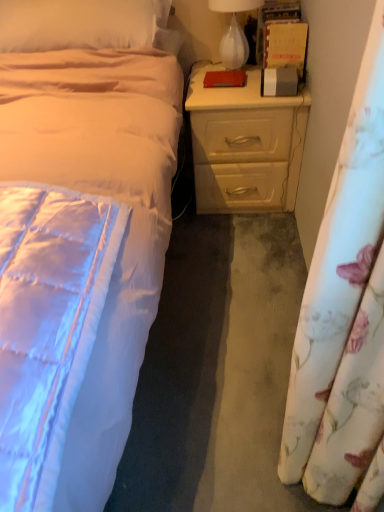
What do you see at coordinates (245, 145) in the screenshot?
I see `beige wood nightstand at right` at bounding box center [245, 145].

What is the approximate height of beige wood nightstand at right?

beige wood nightstand at right is 20.78 inches tall.

Image resolution: width=384 pixels, height=512 pixels. Describe the element at coordinates (80, 23) in the screenshot. I see `beige satin pillow at upper left` at that location.

I want to click on beige wood nightstand at right, so click(x=245, y=145).

Does point (279, 169) come farther from viewer compared to point (324, 321)?

That is True.

Is floral fabric curtain at right inside beige wood nightstand at right?

No, floral fabric curtain at right is not surrounded by beige wood nightstand at right.

How many degrees apart are the facing directions of beige wood nightstand at right and floral fabric curtain at right?

beige wood nightstand at right and floral fabric curtain at right are facing 90 degrees away from each other.

From a real-world perspective, which is physically above, beige wood nightstand at right or floral fabric curtain at right?

floral fabric curtain at right is physically above.

Which point is more forward, (203, 155) or (73, 1)?

The point (73, 1) is closer to the camera.

Is beige wood nightstand at right not close to beige satin pillow at upper left?

No, beige wood nightstand at right is not far from beige satin pillow at upper left.

Is beige wood nightstand at right not inside beige satin pillow at upper left?

That's correct, beige wood nightstand at right is outside of beige satin pillow at upper left.

Is beige wood nightstand at right shorter than beige satin pillow at upper left?

No.

Between beige satin pillow at upper left and white glass lamp at upper right, which one has more height?

beige satin pillow at upper left is taller.

From a real-world perspective, is beige satin pillow at upper left physically above white glass lamp at upper right?

Yes, from a real-world perspective, beige satin pillow at upper left is on top of white glass lamp at upper right.

Is beige satin pillow at upper left beside white glass lamp at upper right?

beige satin pillow at upper left and white glass lamp at upper right are clearly separated.

Identify the location of lamp below the beige satin pillow at upper left (from a real-world perspective). The width and height of the screenshot is (384, 512). (234, 31).

Is floral fabric curtain at right turned away from white glass lamp at upper right?

No.

Between floral fabric curtain at right and white glass lamp at upper right, which one has larger size?

Bigger between the two is floral fabric curtain at right.

Does floral fabric curtain at right appear on the left side of white glass lamp at upper right?

No.

Which object is further away from the camera taking this photo, beige wood nightstand at right or white glass lamp at upper right?

Positioned behind is white glass lamp at upper right.

Is beige wood nightstand at right looking in the opposite direction of white glass lamp at upper right?

No, beige wood nightstand at right is not facing the opposite direction of white glass lamp at upper right.

The height and width of the screenshot is (512, 384). I want to click on lamp on the left of beige wood nightstand at right, so click(234, 31).

Considering the sizes of beige wood nightstand at right and white glass lamp at upper right in the image, is beige wood nightstand at right wider or thinner than white glass lamp at upper right?

Clearly, beige wood nightstand at right has more width compared to white glass lamp at upper right.

Looking at this image, can you confirm if beige satin pillow at upper left is positioned to the left of floral fabric curtain at right?

Indeed, beige satin pillow at upper left is positioned on the left side of floral fabric curtain at right.

From a real-world perspective, is beige satin pillow at upper left above or below floral fabric curtain at right?

beige satin pillow at upper left is situated higher than floral fabric curtain at right in the real world.

Considering the sizes of objects beige satin pillow at upper left and floral fabric curtain at right in the image provided, who is smaller, beige satin pillow at upper left or floral fabric curtain at right?

Smaller between the two is floral fabric curtain at right.

Does point (21, 50) come behind point (346, 173)?

Yes.

Does point (228, 27) come farther from viewer compared to point (225, 110)?

Yes, point (228, 27) is behind point (225, 110).

Would you say white glass lamp at upper right contains beige wood nightstand at right?

No, beige wood nightstand at right is located outside of white glass lamp at upper right.

Considering the positions of objects white glass lamp at upper right and beige wood nightstand at right in the image provided, who is behind, white glass lamp at upper right or beige wood nightstand at right?

white glass lamp at upper right.

Is white glass lamp at upper right smaller than beige wood nightstand at right?

Correct, white glass lamp at upper right occupies less space than beige wood nightstand at right.

Where is `nightstand on the left of floral fabric curtain at right`? The height and width of the screenshot is (512, 384). nightstand on the left of floral fabric curtain at right is located at coordinates (245, 145).

What are the coordinates of `nightstand behind the beige satin pillow at upper left` in the screenshot? It's located at (245, 145).

Which object lies nearer to the anchor point beige wood nightstand at right, white glass lamp at upper right or floral fabric curtain at right?

The object closer to beige wood nightstand at right is white glass lamp at upper right.

Based on their spatial positions, is beige satin pillow at upper left or beige wood nightstand at right closer to floral fabric curtain at right?

beige wood nightstand at right is positioned closer to the anchor floral fabric curtain at right.

Estimate the real-world distances between objects in this image. Which object is closer to white glass lamp at upper right, beige satin pillow at upper left or floral fabric curtain at right?

Among the two, beige satin pillow at upper left is located nearer to white glass lamp at upper right.

Estimate the real-world distances between objects in this image. Which object is further from white glass lamp at upper right, beige wood nightstand at right or beige satin pillow at upper left?

beige satin pillow at upper left is positioned further to the anchor white glass lamp at upper right.

When comparing their distances from white glass lamp at upper right, does beige wood nightstand at right or floral fabric curtain at right seem further?

floral fabric curtain at right is further to white glass lamp at upper right.

Estimate the real-world distances between objects in this image. Which object is further from beige wood nightstand at right, white glass lamp at upper right or beige satin pillow at upper left?

Based on the image, beige satin pillow at upper left appears to be further to beige wood nightstand at right.

Based on their spatial positions, is white glass lamp at upper right or floral fabric curtain at right closer to beige satin pillow at upper left?

The object closer to beige satin pillow at upper left is white glass lamp at upper right.

Looking at the image, which one is located further to floral fabric curtain at right, beige wood nightstand at right or beige satin pillow at upper left?

beige satin pillow at upper left.

This screenshot has width=384, height=512. What are the coordinates of `nightstand between floral fabric curtain at right and white glass lamp at upper right from front to back` in the screenshot? It's located at (245, 145).

You are a GUI agent. You are given a task and a screenshot of the screen. Output one action in this format:
    pyautogui.click(x=<x>, y=<y>)
    Task: Click on the pillow between floral fabric curtain at right and white glass lamp at upper right from front to back
    
    Given the screenshot: What is the action you would take?
    pyautogui.click(x=80, y=23)

At what (x,y) coordinates should I click in order to perform the action: click on pillow positioned between floral fabric curtain at right and beige wood nightstand at right from near to far. Please return your answer as a coordinate pair (x, y). This screenshot has height=512, width=384. Looking at the image, I should click on (80, 23).

Identify the location of lamp located between beige satin pillow at upper left and beige wood nightstand at right in the left-right direction. (234, 31).